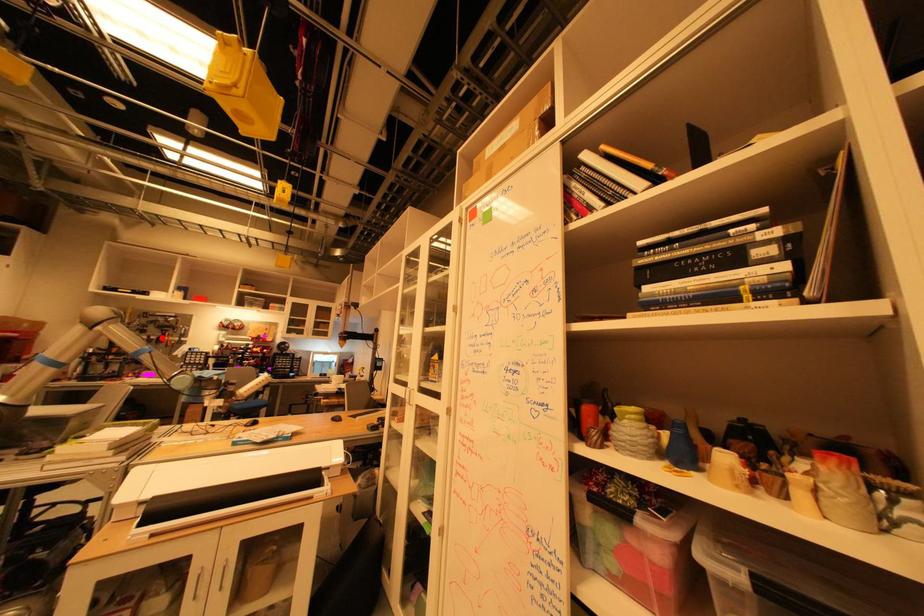
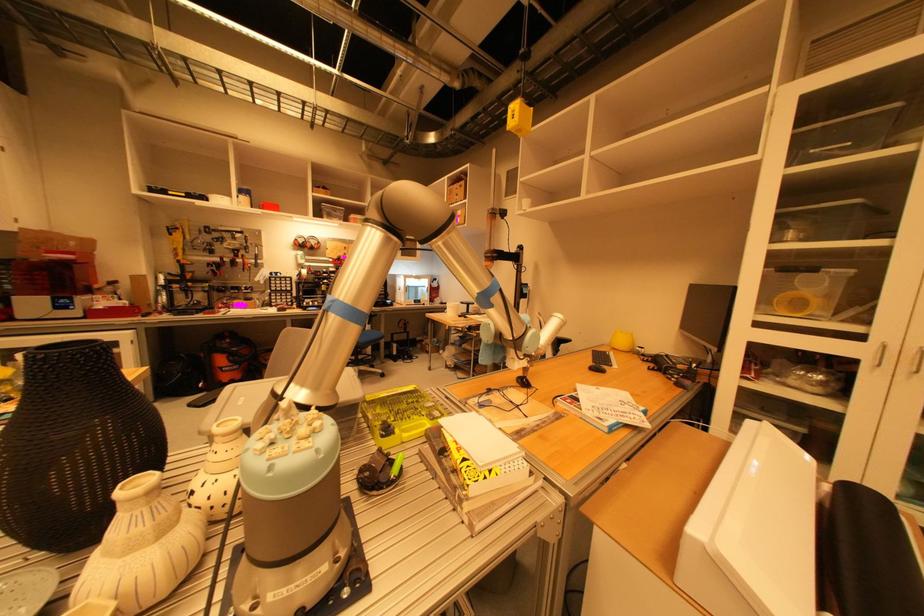
Where in the second image is the point corresponding to the highlighted location from the first image?

(235, 260)